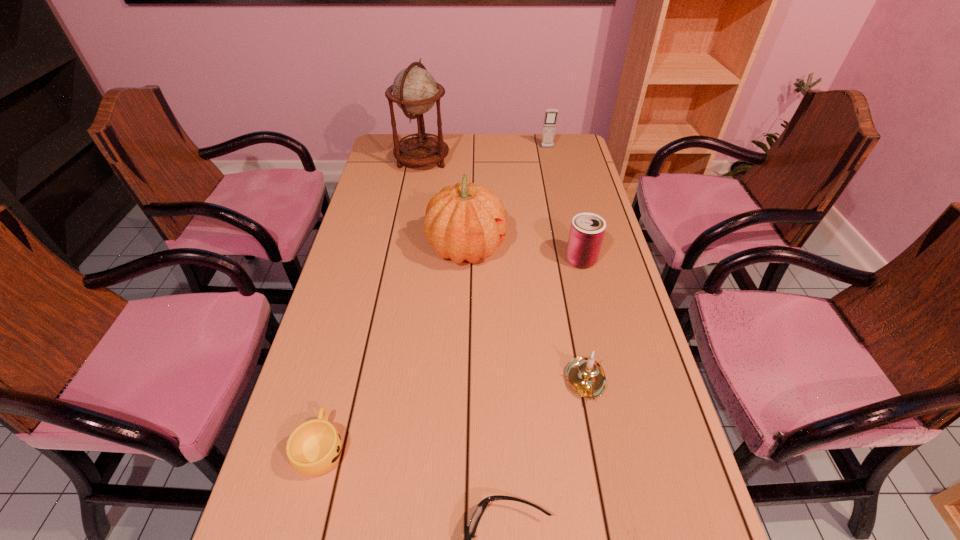
Locate an element on the screen. candle holder that is at the right edge is located at coordinates (585, 376).

You are a GUI agent. You are given a task and a screenshot of the screen. Output one action in this format:
    pyautogui.click(x=<x>, y=<y>)
    Task: Click on the object located in the far left corner section of the desktop
    This screenshot has width=960, height=540.
    Given the screenshot: What is the action you would take?
    pyautogui.click(x=415, y=91)

At what (x,y) coordinates should I click in order to perform the action: click on object at the far right corner. Please return your answer as a coordinate pair (x, y). This screenshot has height=540, width=960. Looking at the image, I should click on (550, 119).

The image size is (960, 540). What are the coordinates of `vacant space at the far edge` in the screenshot? It's located at (492, 147).

Locate an element on the screen. The width and height of the screenshot is (960, 540). vacant space at the left edge is located at coordinates (357, 242).

Identify the location of vacant space at the right edge of the desktop. (652, 413).

Locate an element on the screen. This screenshot has width=960, height=540. free space between the fifth shortest object and the sixth shortest object is located at coordinates (507, 198).

Where is `vacant point located between the can and the sixth farthest object`? vacant point located between the can and the sixth farthest object is located at coordinates (451, 354).

At what (x,y) coordinates should I click in order to perform the action: click on free space between the cellular telephone and the third nearest object. Please return your answer as a coordinate pair (x, y). Looking at the image, I should click on (566, 265).

Point out which object is positioned as the third nearest to the pumpkin. Please provide its 2D coordinates. Your answer should be formatted as a tuple, i.e. [(x, y)], where the tuple contains the x and y coordinates of a point satisfying the conditions above.

[(585, 376)]